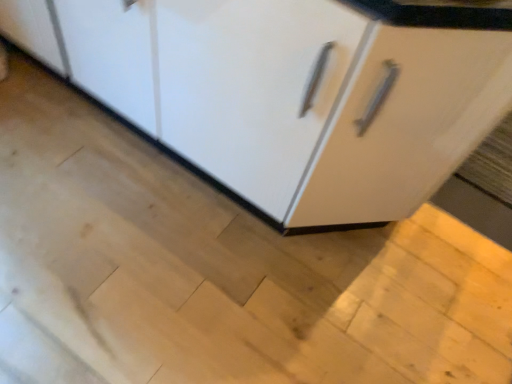
The image size is (512, 384). Describe the element at coordinates (304, 95) in the screenshot. I see `white glossy cabinet at upper center` at that location.

Identify the location of white glossy cabinet at upper center. (304, 95).

This screenshot has height=384, width=512. What are the coordinates of `white glossy cabinet at upper center` in the screenshot? It's located at (304, 95).